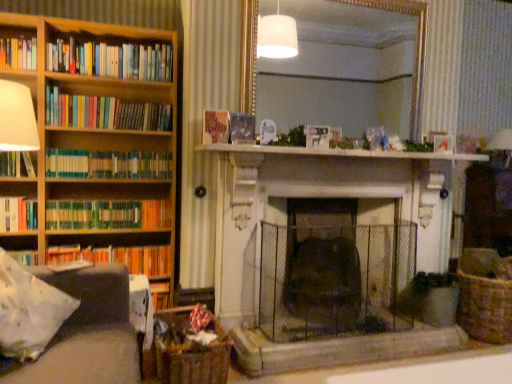
Question: From the image's perspective, is hardcover books at left, the 8th book ordered from the bottom, located above or below white marble fireplace at center?

Choices:
 (A) below
 (B) above

Answer: (B)

Question: From a real-world perspective, is hardcover books at left, the 8th book ordered from the bottom, physically located above or below white marble fireplace at center?

Choices:
 (A) below
 (B) above

Answer: (B)

Question: Considering the real-world distances, which object is farthest from the hardcover book at left, arranged as the 5th book when ordered from the bottom?

Choices:
 (A) hardcover book at left, the first book when ordered from bottom to top
 (B) woven brown basket at lower left, positioned as the 1th basket in front-to-back order
 (C) wooden bookshelf at left
 (D) wooden bookshelf at left
 (E) green matte bookshelf at left, placed as the fifth book when sorted from top to bottom

Answer: (B)

Question: Estimate the real-world distances between objects in this image. Which object is closer to the hardcover books at left, the 8th book ordered from the bottom?

Choices:
 (A) hardcover book at left, the 6th book when ordered from top to bottom
 (B) white marble fireplace at center
 (C) woven brown basket at lower right, which is the 2th basket from left to right
 (D) gold-framed mirror at upper center
 (E) wooden book at center, the 6th book in the bottom-to-top sequence

Answer: (E)